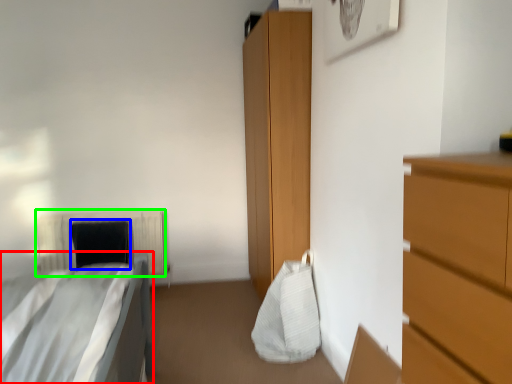
Question: Which object is positioned closest to bed (highlighted by a red box)? Select from pillow (highlighted by a blue box) and radiator (highlighted by a green box).

Choices:
 (A) pillow
 (B) radiator

Answer: (A)